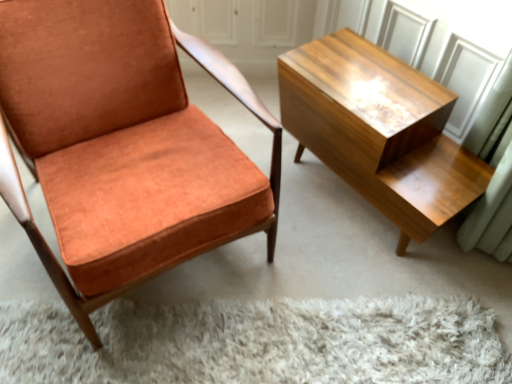
What do you see at coordinates (123, 144) in the screenshot?
I see `matte orange fabric chair at left` at bounding box center [123, 144].

The image size is (512, 384). What are the coordinates of `matte orange fabric chair at left` in the screenshot? It's located at (123, 144).

What do you see at coordinates (380, 131) in the screenshot? I see `shiny wood table at right` at bounding box center [380, 131].

What is the approximate height of shiny wood table at right?

shiny wood table at right is 17.92 inches tall.

You are a GUI agent. You are given a task and a screenshot of the screen. Output one action in this format:
    pyautogui.click(x=<x>, y=<y>)
    Task: Click on the shiny wood table at right
    The height and width of the screenshot is (384, 512).
    Given the screenshot: What is the action you would take?
    pyautogui.click(x=380, y=131)

Locate an element on the screen. matte orange fabric chair at left is located at coordinates (123, 144).

Can you confirm if shiny wood table at right is positioned to the right of matte orange fabric chair at left?

Yes.

Is shiny wood table at right positioned in front of matte orange fabric chair at left?

No, shiny wood table at right is further to the viewer.

Does point (442, 175) appear closer or farther from the camera than point (66, 125)?

Point (442, 175) appears to be farther away from the viewer than point (66, 125).

Consider the image. From the image's perspective, which one is positioned lower, shiny wood table at right or matte orange fabric chair at left?

shiny wood table at right, from the image's perspective.

From a real-world perspective, which object rests below the other?

From a 3D spatial view, shiny wood table at right is below.

Does shiny wood table at right have a greater width compared to matte orange fabric chair at left?

In fact, shiny wood table at right might be narrower than matte orange fabric chair at left.

Between shiny wood table at right and matte orange fabric chair at left, which one has more height?

With more height is matte orange fabric chair at left.

Looking at this image, considering the relative sizes of shiny wood table at right and matte orange fabric chair at left in the image provided, is shiny wood table at right smaller than matte orange fabric chair at left?

Correct, shiny wood table at right occupies less space than matte orange fabric chair at left.

Is shiny wood table at right spatially inside matte orange fabric chair at left, or outside of it?

shiny wood table at right exists outside the volume of matte orange fabric chair at left.

Are shiny wood table at right and matte orange fabric chair at left making contact?

shiny wood table at right is not next to matte orange fabric chair at left, and they're not touching.

Is matte orange fabric chair at left at the back of shiny wood table at right?

No, shiny wood table at right's orientation is not away from matte orange fabric chair at left.

How much distance is there between shiny wood table at right and matte orange fabric chair at left?

shiny wood table at right and matte orange fabric chair at left are 20.20 inches apart from each other.

The height and width of the screenshot is (384, 512). In the image, there is a matte orange fabric chair at left. In order to click on table below it (from the image's perspective) in this screenshot , I will do `click(380, 131)`.

Does matte orange fabric chair at left appear on the left side of shiny wood table at right?

Indeed, matte orange fabric chair at left is positioned on the left side of shiny wood table at right.

Is matte orange fabric chair at left in front of or behind shiny wood table at right in the image?

Clearly, matte orange fabric chair at left is in front of shiny wood table at right.

Between point (65, 188) and point (451, 177), which one is positioned in front?

Point (65, 188)

From the image's perspective, is matte orange fabric chair at left under shiny wood table at right?

A: No.

From a real-world perspective, is matte orange fabric chair at left located beneath shiny wood table at right?

No, from a real-world perspective, matte orange fabric chair at left is not under shiny wood table at right.

Which of these two, matte orange fabric chair at left or shiny wood table at right, is thinner?

Thinner between the two is shiny wood table at right.

In the scene shown: Who is taller, matte orange fabric chair at left or shiny wood table at right?

matte orange fabric chair at left.

From the picture: Which of these two, matte orange fabric chair at left or shiny wood table at right, is smaller?

shiny wood table at right is smaller.

Do you think matte orange fabric chair at left is within shiny wood table at right, or outside of it?

matte orange fabric chair at left is not enclosed by shiny wood table at right.

Would you say matte orange fabric chair at left is a long distance from shiny wood table at right?

No.

Does matte orange fabric chair at left turn towards shiny wood table at right?

No.

I want to click on chair in front of the shiny wood table at right, so click(x=123, y=144).

Image resolution: width=512 pixels, height=384 pixels. Find the location of `table that appears below the matte orange fabric chair at left (from a real-world perspective)`. table that appears below the matte orange fabric chair at left (from a real-world perspective) is located at coordinates tap(380, 131).

Where is `table on the right of matte orange fabric chair at left`? The height and width of the screenshot is (384, 512). table on the right of matte orange fabric chair at left is located at coordinates (380, 131).